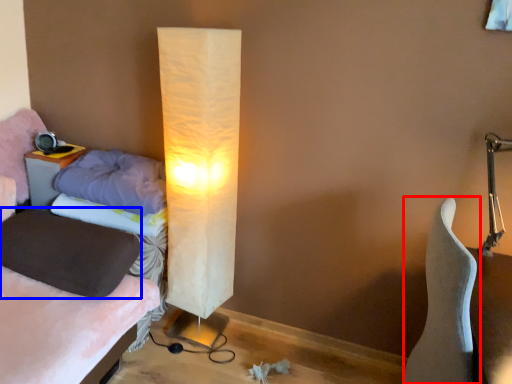
Question: Which point is further to the camera, furniture (highlighted by a red box) or pillow (highlighted by a blue box)?

Choices:
 (A) furniture
 (B) pillow

Answer: (B)